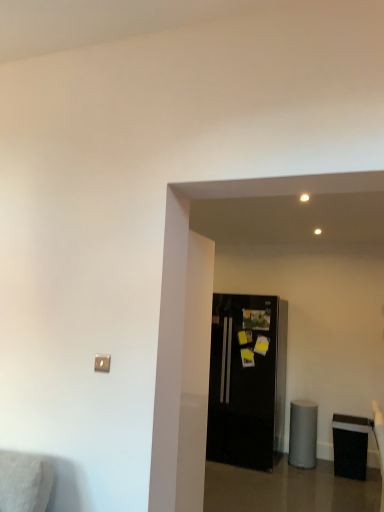
Identify the location of vacant area that is in front of black glossy refrigerator at center. (267, 482).